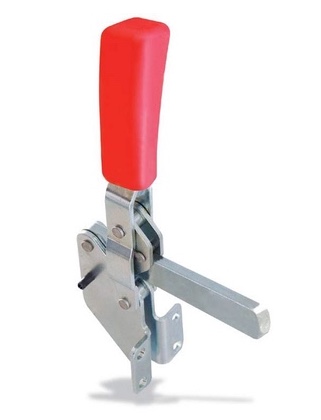
Where is `metal knob above black piece`? This screenshot has width=321, height=420. metal knob above black piece is located at coordinates [87, 246].